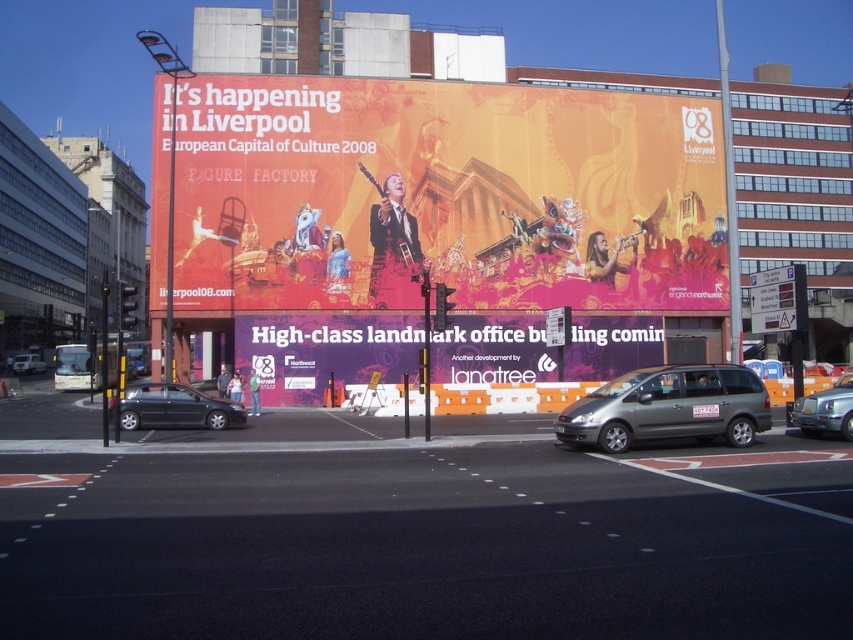
Question: Which of the following is the closest to the observer?

Choices:
 (A) (846, 403)
 (B) (27, 372)

Answer: (A)

Question: Which point is farther to the camera?

Choices:
 (A) (840, 403)
 (B) (709, 368)
 (C) (38, 371)
 (D) (540, 172)

Answer: (C)

Question: Can you confirm if orange matte billboard at upper center is positioned to the right of silver metallic car at lower left?

Choices:
 (A) yes
 (B) no

Answer: (A)

Question: Is purple matte sign at center below silver metallic car at lower left?

Choices:
 (A) yes
 (B) no

Answer: (B)

Question: Estimate the real-world distances between objects in this image. Which object is farther from the matte black car at lower left?

Choices:
 (A) purple matte sign at center
 (B) silver metallic car at lower left

Answer: (B)

Question: Does metallic gray minivan at center have a lesser width compared to matte black car at lower left?

Choices:
 (A) yes
 (B) no

Answer: (A)